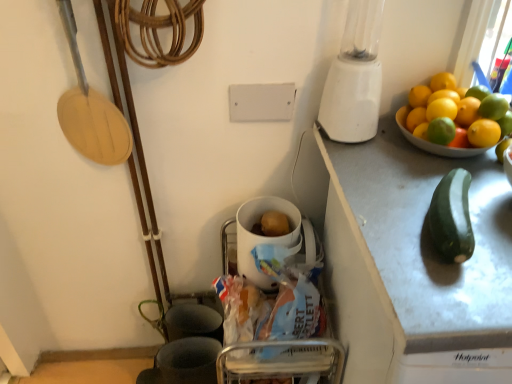
Question: Considering the relative sizes of green matte zucchini at right and white plastic blender at upper right in the image provided, is green matte zucchini at right taller than white plastic blender at upper right?

Choices:
 (A) no
 (B) yes

Answer: (A)

Question: Does green matte zucchini at right appear on the right side of white plastic blender at upper right?

Choices:
 (A) no
 (B) yes

Answer: (B)

Question: Does green matte zucchini at right lie behind white plastic blender at upper right?

Choices:
 (A) no
 (B) yes

Answer: (B)

Question: From a real-world perspective, does green matte zucchini at right stand above white plastic blender at upper right?

Choices:
 (A) yes
 (B) no

Answer: (B)

Question: Considering the relative sizes of green matte zucchini at right and white plastic blender at upper right in the image provided, is green matte zucchini at right thinner than white plastic blender at upper right?

Choices:
 (A) no
 (B) yes

Answer: (B)

Question: Considering the positions of orange matte at upper right and green matte zucchini at right in the image, is orange matte at upper right bigger or smaller than green matte zucchini at right?

Choices:
 (A) big
 (B) small

Answer: (B)

Question: From the image's perspective, is orange matte at upper right above or below green matte zucchini at right?

Choices:
 (A) above
 (B) below

Answer: (A)

Question: Is orange matte at upper right taller or shorter than green matte zucchini at right?

Choices:
 (A) short
 (B) tall

Answer: (A)

Question: Considering their positions, is orange matte at upper right located in front of or behind green matte zucchini at right?

Choices:
 (A) front
 (B) behind

Answer: (B)

Question: Considering the positions of point (257, 203) and point (454, 150), is point (257, 203) closer or farther from the camera than point (454, 150)?

Choices:
 (A) closer
 (B) farther

Answer: (B)

Question: Is white glossy mug at center taller or shorter than white ceramic bowl at upper right?

Choices:
 (A) short
 (B) tall

Answer: (B)

Question: Considering the relative positions of white glossy mug at center and white ceramic bowl at upper right in the image provided, is white glossy mug at center to the left or to the right of white ceramic bowl at upper right?

Choices:
 (A) left
 (B) right

Answer: (A)

Question: From a real-world perspective, is white glossy mug at center positioned above or below white ceramic bowl at upper right?

Choices:
 (A) above
 (B) below

Answer: (B)

Question: From a real-world perspective, is yellow matte lemon at upper right, acting as the 4th lemon starting from the bottom, positioned above or below yellow matte lemon at upper right, arranged as the first lemon when viewed from the top?

Choices:
 (A) above
 (B) below

Answer: (B)

Question: Is yellow matte lemon at upper right, acting as the 4th lemon starting from the bottom, taller or shorter than yellow matte lemon at upper right, arranged as the first lemon when viewed from the top?

Choices:
 (A) short
 (B) tall

Answer: (B)